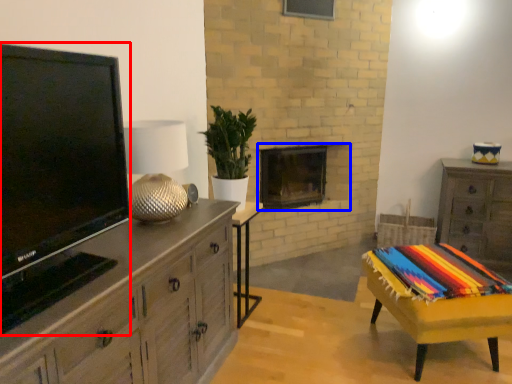
Question: Which object appears farthest to the camera in this image, television (highlighted by a red box) or fireplace (highlighted by a blue box)?

Choices:
 (A) television
 (B) fireplace

Answer: (B)